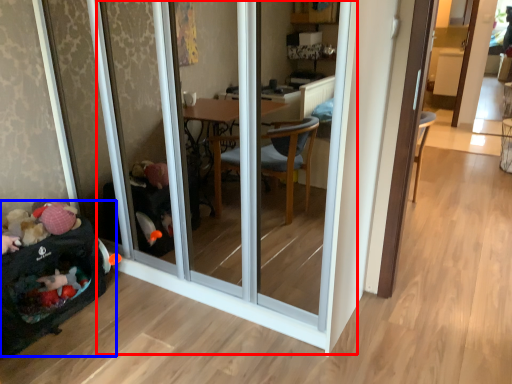
Question: Which of the following is the closest to the observer, screen door (highlighted by a red box) or baby carriage (highlighted by a blue box)?

Choices:
 (A) screen door
 (B) baby carriage

Answer: (A)